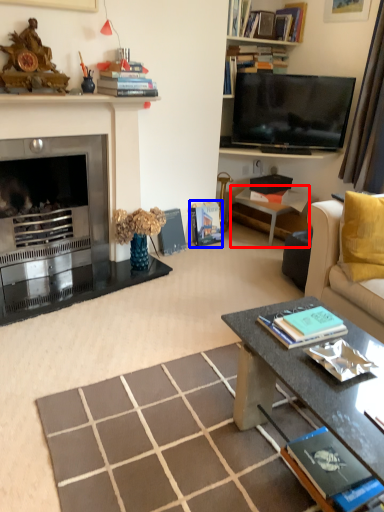
Question: Which object is further to the camera taking this photo, side table (highlighted by a red box) or book (highlighted by a blue box)?

Choices:
 (A) side table
 (B) book

Answer: (B)